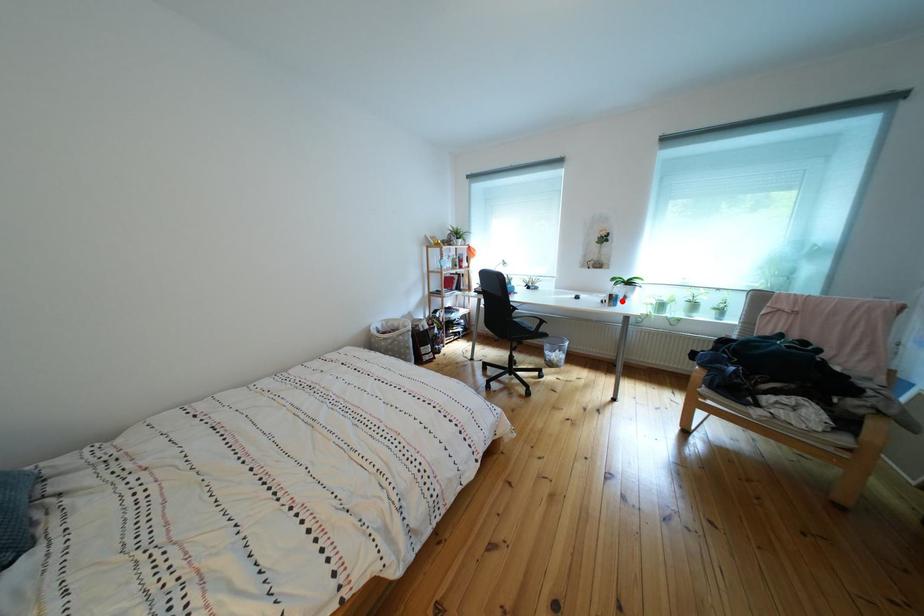
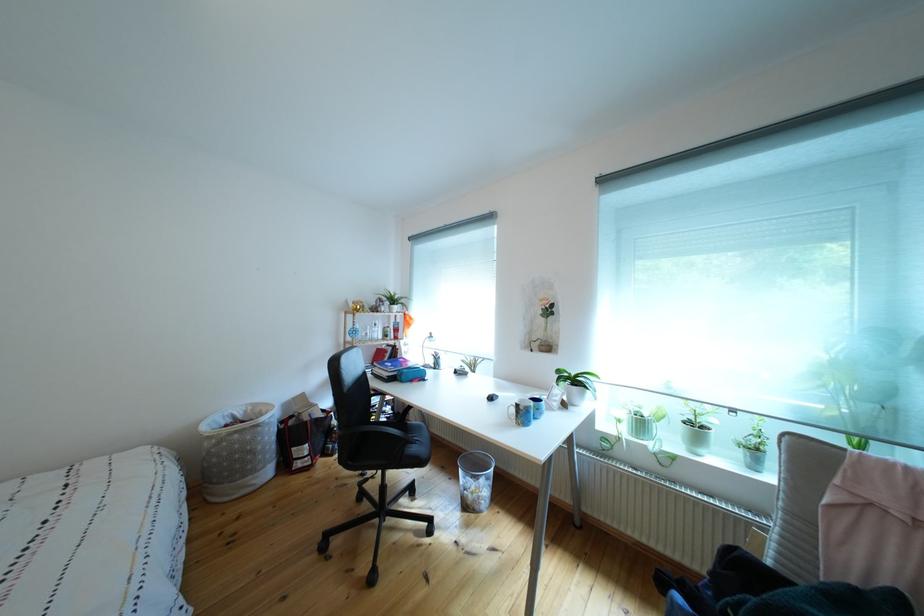
In the second image, find the point that corresponds to the highlighted location in the first image.

(529, 411)